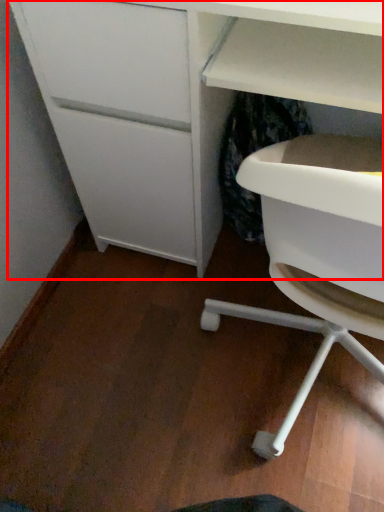
Question: From the image's perspective, where is desk (annotated by the red box) located in relation to cabinetry in the image?

Choices:
 (A) below
 (B) above

Answer: (B)